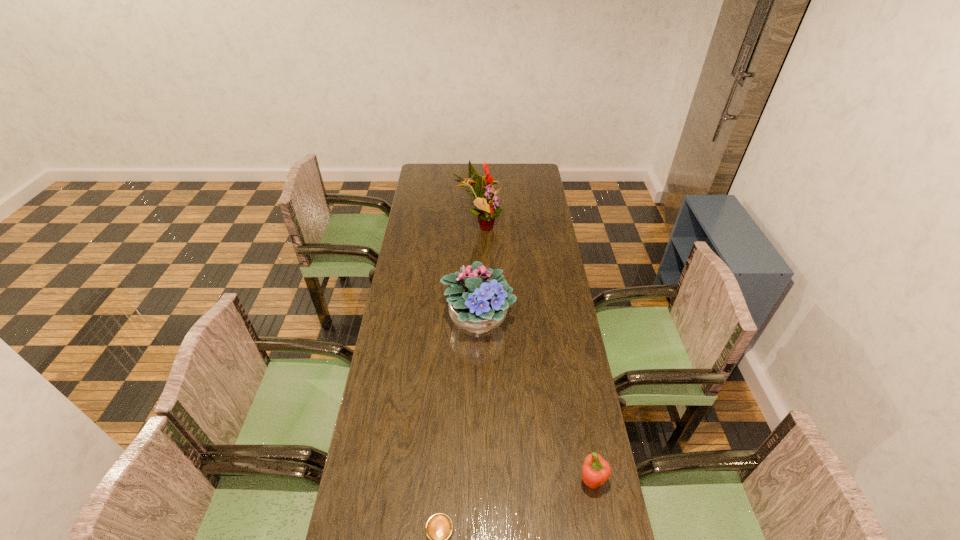
Identify the location of free spot that satisfies the following two spatial constraints: 1. on the front-facing side of the third farthest object; 2. on the left side of the taller bouquet. (478, 481).

At what (x,y) coordinates should I click in order to perform the action: click on vacant space that satisfies the following two spatial constraints: 1. on the back side of the pepper; 2. on the front-facing side of the tallest object. Please return your answer as a coordinate pair (x, y). Looking at the image, I should click on [545, 225].

At what (x,y) coordinates should I click in order to perform the action: click on free spot that satisfies the following two spatial constraints: 1. on the front-facing side of the third farthest object; 2. on the left side of the farther bouquet. Please return your answer as a coordinate pair (x, y). This screenshot has height=540, width=960. Looking at the image, I should click on (478, 481).

Find the location of a particular element. The height and width of the screenshot is (540, 960). vacant area that satisfies the following two spatial constraints: 1. on the front side of the nearer bouquet; 2. on the right side of the pepper is located at coordinates (477, 481).